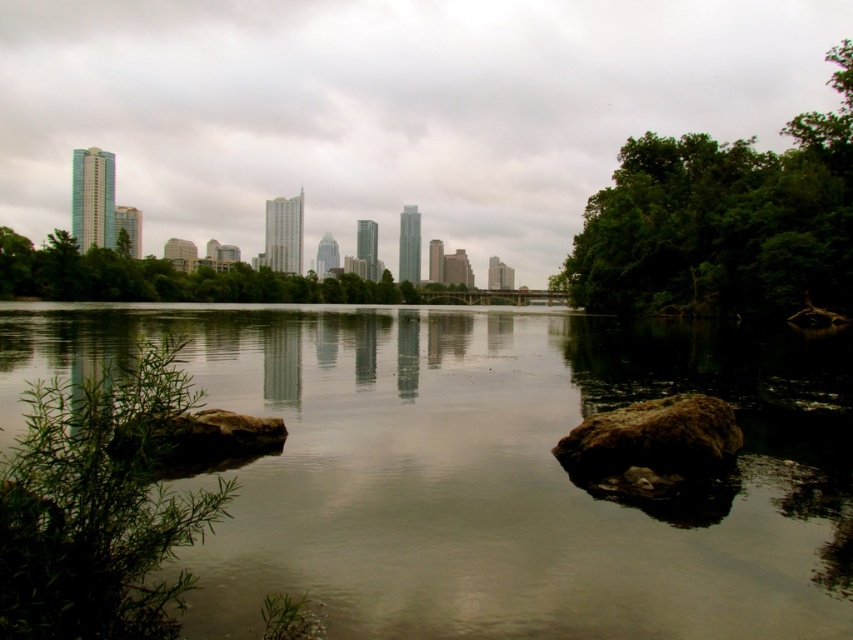
You are an urban planner analyzing this riverside scene. You need to place a new bench for visitors. The bench must be placed 0.1 units to the left of the green leafy trees at right. What are the coordinates of the bench?

The coordinates of the bench would be approximately 0.347 minus 0.1 equals 0.247 in the x direction, so the coordinates are (724, 157).

You are a geologist examining the riverside scene. You notice a brown rough rock at center. Can you determine its exact position in the image using the coordinate system provided?

The brown rough rock at center is located at point (x=654, y=440).

You are standing at the riverside and want to know how far the point at coordinates point (688, 456) is from your current position. Can you determine the distance?

The point (688, 456) is 11.87 meters away from your current position.